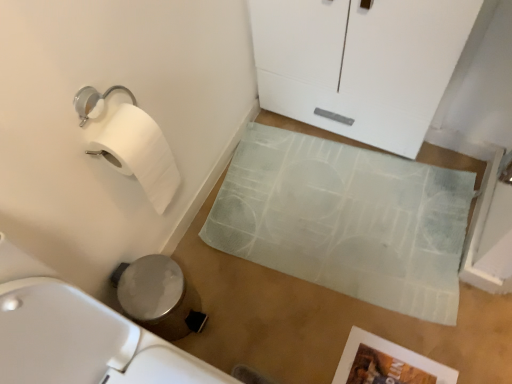
Question: Is white glossy cabinet at upper center inside or outside of white textured bath mat at center?

Choices:
 (A) inside
 (B) outside

Answer: (B)

Question: Is white glossy cabinet at upper center in front of or behind white textured bath mat at center in the image?

Choices:
 (A) behind
 (B) front

Answer: (B)

Question: Does point (395, 147) appear closer or farther from the camera than point (345, 147)?

Choices:
 (A) farther
 (B) closer

Answer: (B)

Question: In terms of height, does white textured bath mat at center look taller or shorter compared to white glossy cabinet at upper center?

Choices:
 (A) short
 (B) tall

Answer: (A)

Question: Considering their positions, is white textured bath mat at center located in front of or behind white glossy cabinet at upper center?

Choices:
 (A) front
 (B) behind

Answer: (B)

Question: Looking at their shapes, would you say white textured bath mat at center is wider or thinner than white glossy cabinet at upper center?

Choices:
 (A) wide
 (B) thin

Answer: (A)

Question: Is white textured bath mat at center inside or outside of white glossy cabinet at upper center?

Choices:
 (A) outside
 (B) inside

Answer: (A)